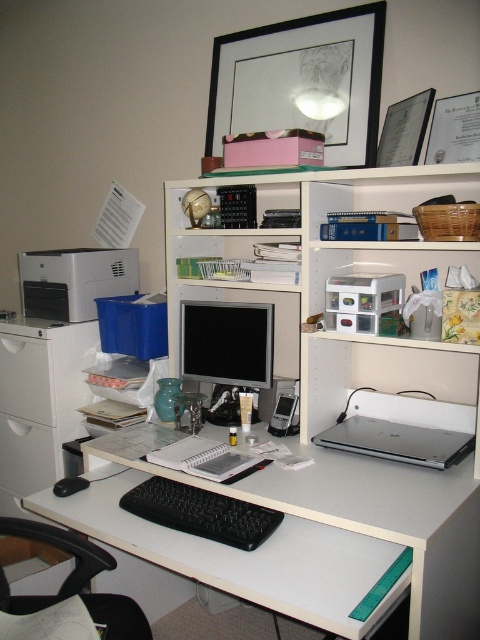
Does white plastic drawers at upper center have a larger size compared to black plastic calculator at center?

Indeed, white plastic drawers at upper center has a larger size compared to black plastic calculator at center.

Can you confirm if white plastic drawers at upper center is taller than black plastic calculator at center?

Indeed, white plastic drawers at upper center has a greater height compared to black plastic calculator at center.

Identify the location of white plastic drawers at upper center. (379, 262).

Which is above, matte black monitor at center or matte white printer at left?

matte white printer at left is higher up.

Can you confirm if matte black monitor at center is positioned to the right of matte white printer at left?

Yes, matte black monitor at center is to the right of matte white printer at left.

Is point (215, 307) positioned before point (117, 292)?

Yes.

What are the coordinates of `matte black monitor at center` in the screenshot? It's located at (227, 352).

Based on the photo, which is more to the right, matte white printer at left or silver metallic laptop at center?

Positioned to the right is silver metallic laptop at center.

Does matte white printer at left have a smaller size compared to silver metallic laptop at center?

Incorrect, matte white printer at left is not smaller in size than silver metallic laptop at center.

At what (x,y) coordinates should I click in order to perform the action: click on matte white printer at left. Please return your answer as a coordinate pair (x, y). Looking at the image, I should click on (74, 280).

You are a GUI agent. You are given a task and a screenshot of the screen. Output one action in this format:
    pyautogui.click(x=<x>, y=<y>)
    Task: Click on the matte white printer at left
    The image size is (480, 640).
    Given the screenshot: What is the action you would take?
    click(74, 280)